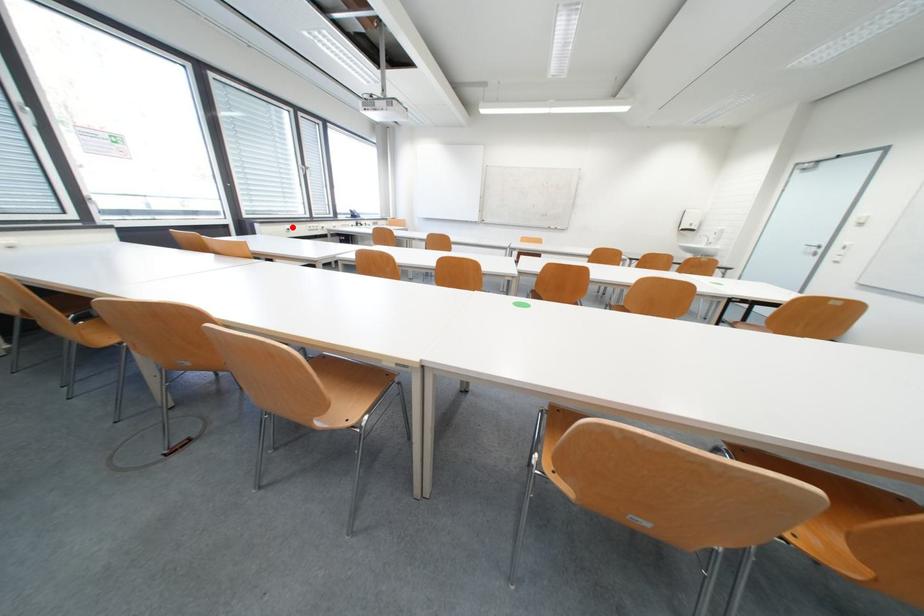
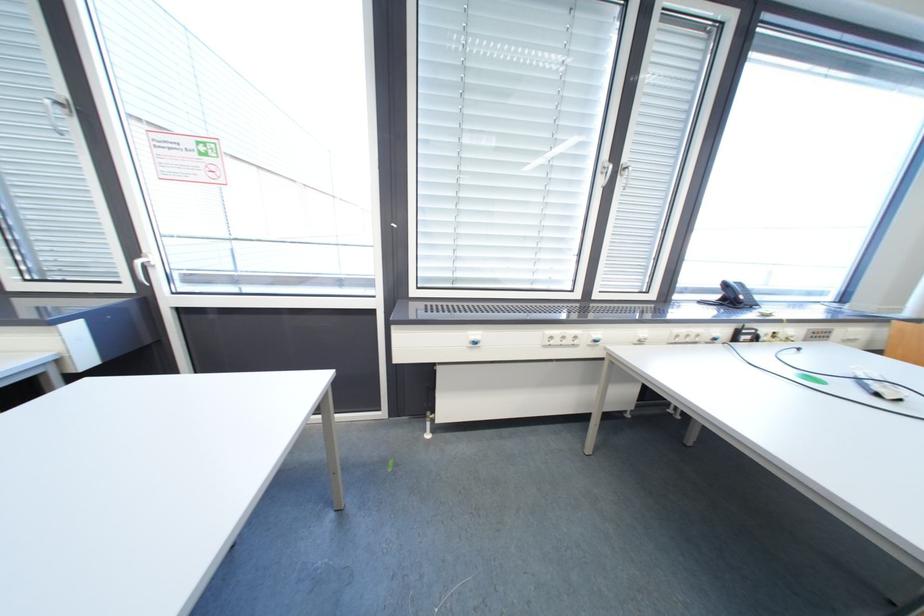
Question: I am providing you with two images of the same scene from different viewpoints. Image1 has a red point marked. In image2, the corresponding 3D location appears at what relative position? Reply with the corresponding letter.

Choices:
 (A) Closer
 (B) Farther

Answer: (B)